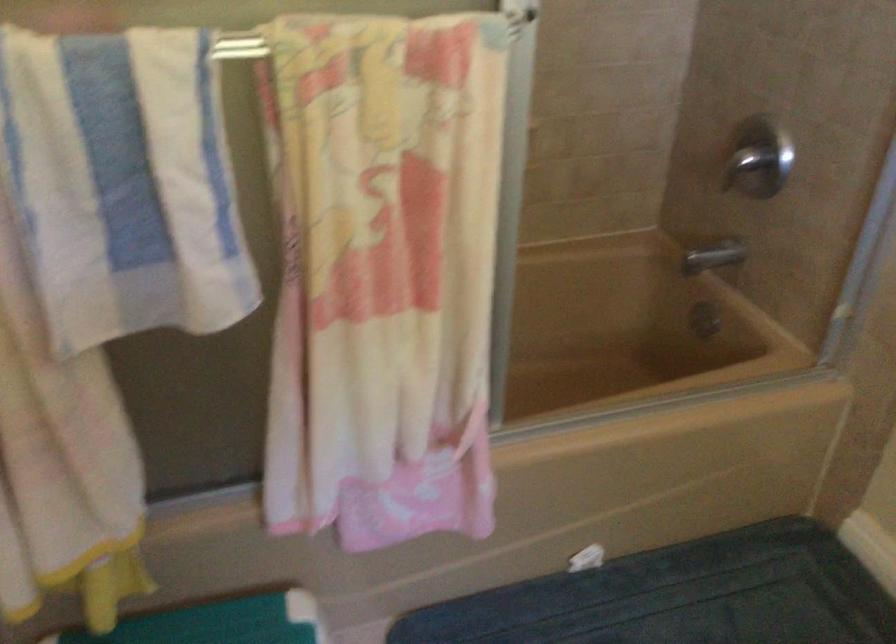
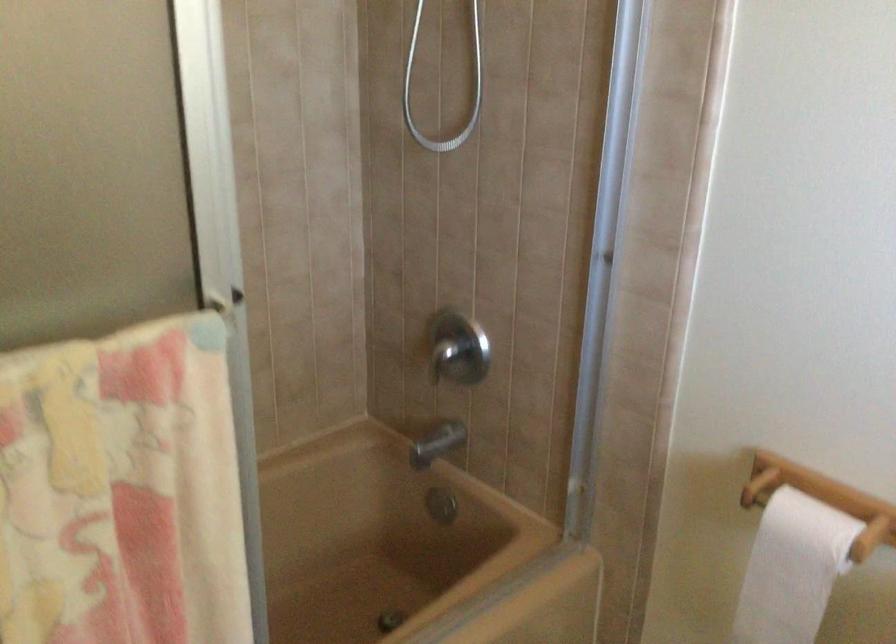
In the second image, find the point that corresponds to pixel 752 158 in the first image.

(458, 348)